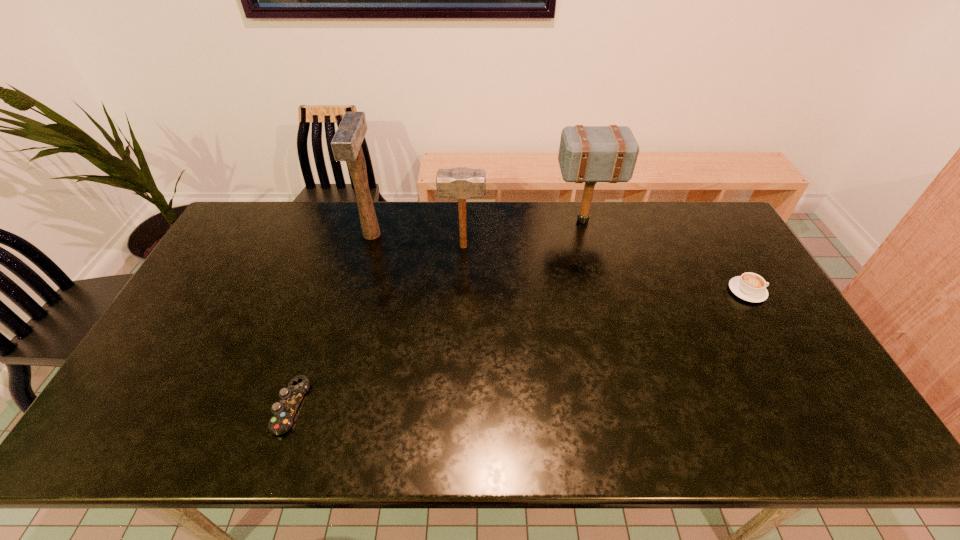
Where is `free point between the rightmost object and the rightmost mallet`? free point between the rightmost object and the rightmost mallet is located at coordinates (665, 256).

You are a GUI agent. You are given a task and a screenshot of the screen. Output one action in this format:
    pyautogui.click(x=<x>, y=<y>)
    Task: Click on the unoccupied position between the shortest object and the leftmost mallet
    This screenshot has height=540, width=960.
    Given the screenshot: What is the action you would take?
    pyautogui.click(x=331, y=320)

Find the location of `object identified as the fourth closest to the tallest object`. object identified as the fourth closest to the tallest object is located at coordinates (751, 287).

Choose which object is the nearest neighbor to the second mallet from right to left. Please provide its 2D coordinates. Your answer should be formatted as a tuple, i.e. [(x, y)], where the tuple contains the x and y coordinates of a point satisfying the conditions above.

[(346, 144)]

Locate which mallet ranks second in proximity to the nearest object. Please provide its 2D coordinates. Your answer should be formatted as a tuple, i.e. [(x, y)], where the tuple contains the x and y coordinates of a point satisfying the conditions above.

[(461, 183)]

Image resolution: width=960 pixels, height=540 pixels. I want to click on the second closest mallet to the second tallest object, so click(x=346, y=144).

This screenshot has width=960, height=540. In order to click on vacant space that satisfies the following two spatial constraints: 1. on the side of the cappuccino with the handle; 2. on the front side of the shortest object in this screenshot , I will do `click(814, 406)`.